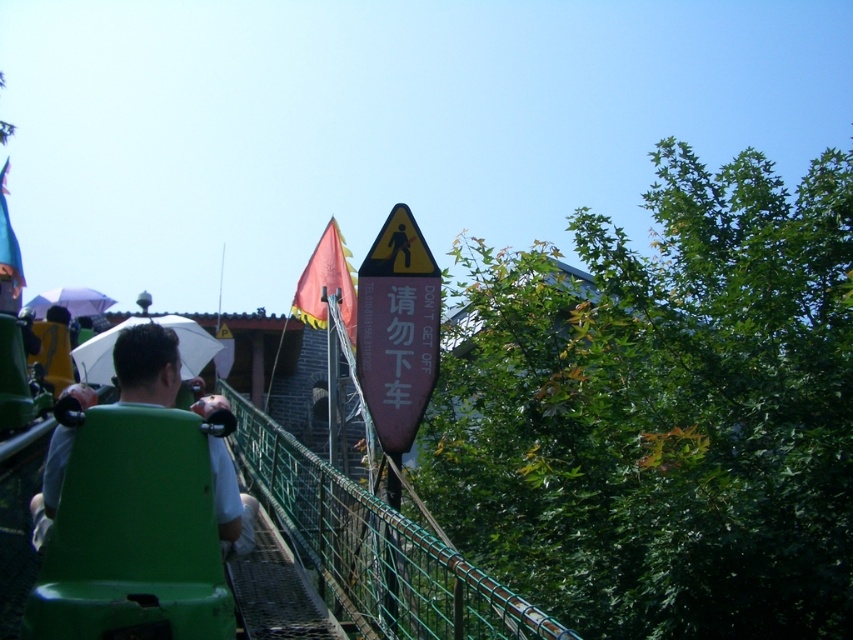
Question: Which point is farther from the camera taking this photo?

Choices:
 (A) (73, 429)
 (B) (64, 381)
 (C) (109, 358)

Answer: (B)

Question: Which of the following is the closest to the observer?

Choices:
 (A) pink matte sign at center
 (B) green plastic chair at center
 (C) matte black helmet at left

Answer: (B)

Question: Is pink matte sign at center to the left of white matte umbrella at upper left from the viewer's perspective?

Choices:
 (A) yes
 (B) no

Answer: (B)

Question: Is pink matte sign at center smaller than matte black helmet at left?

Choices:
 (A) yes
 (B) no

Answer: (A)

Question: Is pink matte sign at center to the right of green plastic chair at center from the viewer's perspective?

Choices:
 (A) yes
 (B) no

Answer: (A)

Question: Which point is closer to the camera?

Choices:
 (A) white matte umbrella at upper left
 (B) green plastic chair at center
 (C) matte black helmet at left
 (D) white matte umbrella at upper center

Answer: (B)